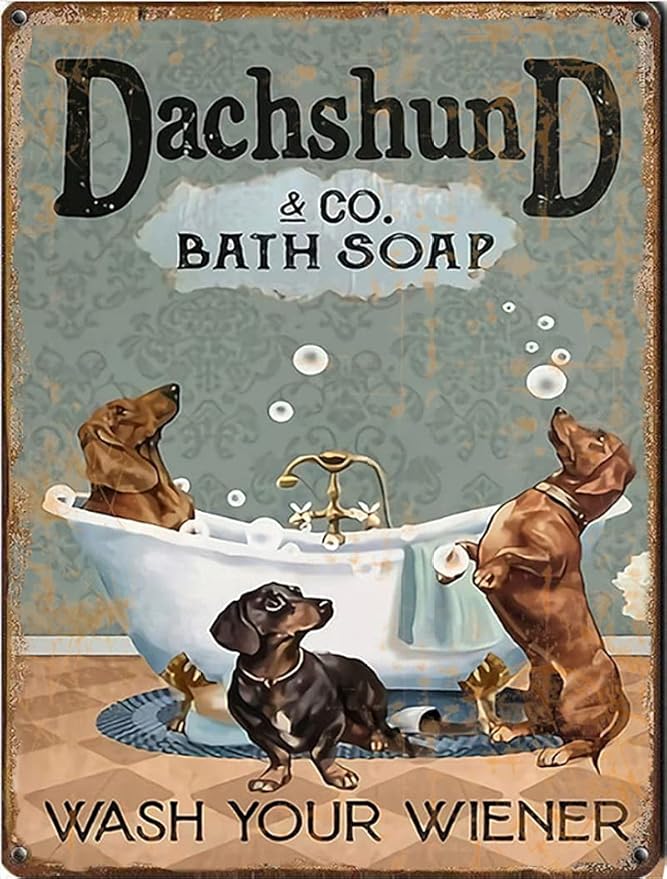
I want to click on mat, so click(147, 734).